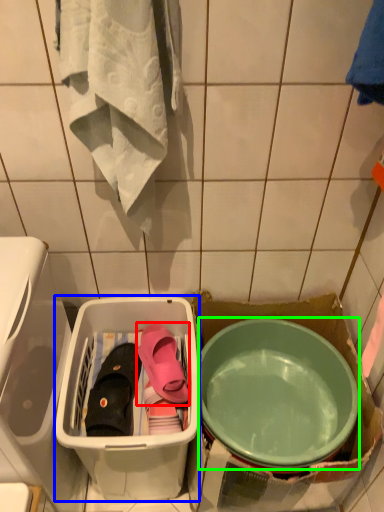
Question: Considering the real-world distances, which object is closest to footwear (highlighted by a red box)? storage box (highlighted by a blue box) or mixing bowl (highlighted by a green box).

Choices:
 (A) storage box
 (B) mixing bowl

Answer: (A)